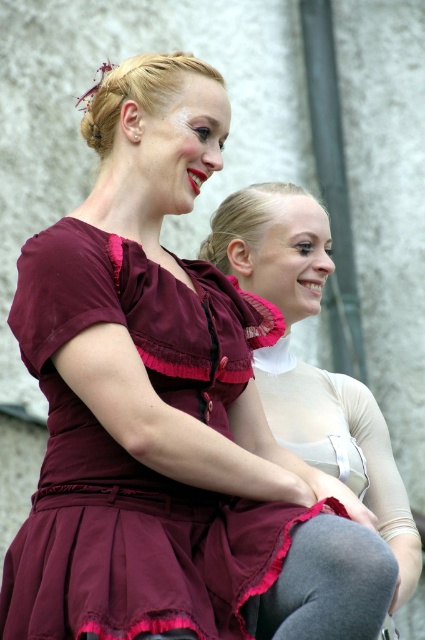
Based on the photo, you are a photographer setting up for a photoshoot and need to position two models wearing the burgundy satin dress at center and the matte burgundy dress at center. Since both dresses are burgundy, you want to ensure they are distinguishable in the final photo. Based on the description, which dress should you place closer to the camera to make their height difference more noticeable?

The burgundy satin dress at center has a lesser height compared to the matte burgundy dress at center. To emphasize their height difference, place the shorter burgundy satin dress at center closer to the camera so its size appears more comparable to the taller matte burgundy dress at center in the photo.